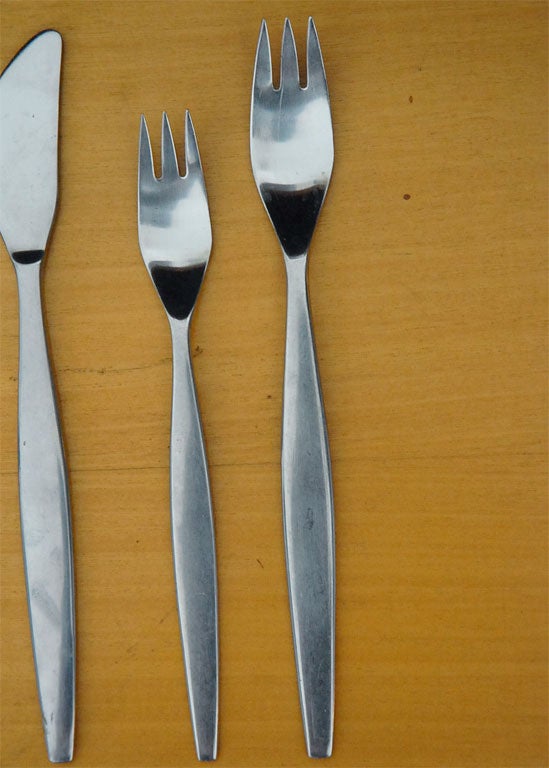
Where is `butter knife`? This screenshot has width=549, height=768. butter knife is located at coordinates (29, 305).